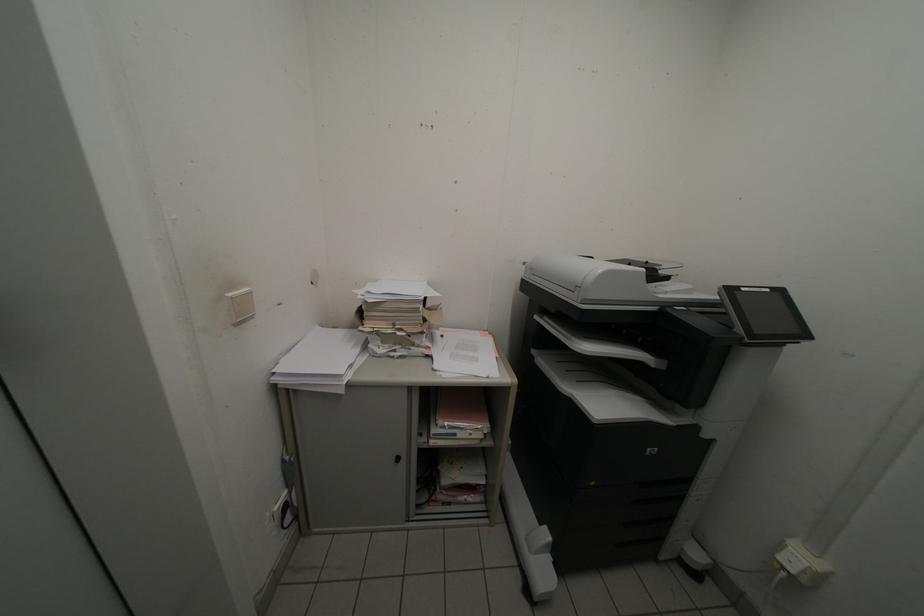
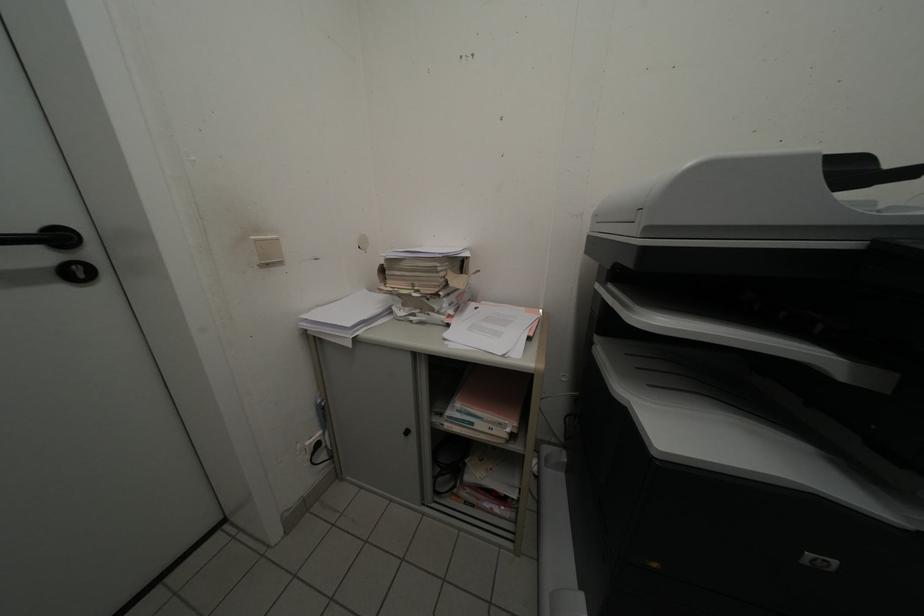
Consider the image. What movement of the cameraman would produce the second image?

The cameraman walked toward right, forward.